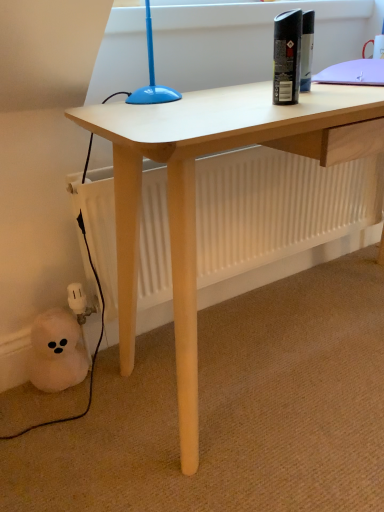
What do you see at coordinates (92, 356) in the screenshot? I see `black rubber cable at lower left` at bounding box center [92, 356].

Find the location of a particular element. black rubber cable at lower left is located at coordinates coord(92,356).

Describe the element at coordinates (287, 57) in the screenshot. This screenshot has height=512, width=384. I see `black matte spray can at upper right` at that location.

The image size is (384, 512). I want to click on black matte spray can at upper right, so click(x=287, y=57).

Find the location of `black rubber cable at lower left`. black rubber cable at lower left is located at coordinates (92, 356).

Is black rubber cable at lower left to the left of black matte spray can at upper right from the viewer's perspective?

Indeed, black rubber cable at lower left is positioned on the left side of black matte spray can at upper right.

Considering the positions of objects black rubber cable at lower left and black matte spray can at upper right in the image provided, who is in front, black rubber cable at lower left or black matte spray can at upper right?

black matte spray can at upper right.

Which is behind, point (95, 352) or point (282, 94)?

The point (95, 352) is behind.

From the image's perspective, is black rubber cable at lower left located above black matte spray can at upper right?

Actually, black rubber cable at lower left appears below black matte spray can at upper right in the image.

From a real-world perspective, does black rubber cable at lower left stand above black matte spray can at upper right?

No, from a real-world perspective, black rubber cable at lower left is not over black matte spray can at upper right

Does black rubber cable at lower left have a greater width compared to black matte spray can at upper right?

Indeed, black rubber cable at lower left has a greater width compared to black matte spray can at upper right.

Is black rubber cable at lower left taller than black matte spray can at upper right?

Correct, black rubber cable at lower left is much taller as black matte spray can at upper right.

Is black rubber cable at lower left bigger than black matte spray can at upper right?

Yes, black rubber cable at lower left is bigger than black matte spray can at upper right.

Can we say black rubber cable at lower left lies outside black matte spray can at upper right?

Yes, black rubber cable at lower left is outside of black matte spray can at upper right.

Are black rubber cable at lower left and black matte spray can at upper right far apart?

No, black rubber cable at lower left is in close proximity to black matte spray can at upper right.

Could you tell me if black rubber cable at lower left is turned towards black matte spray can at upper right?

No, black rubber cable at lower left is not facing towards black matte spray can at upper right.

What's the angular difference between black rubber cable at lower left and black matte spray can at upper right's facing directions?

The facing directions of black rubber cable at lower left and black matte spray can at upper right are 0.00332 degrees apart.

How far apart are black rubber cable at lower left and black matte spray can at upper right?

They are 25.35 inches apart.

Locate an element on the screen. The width and height of the screenshot is (384, 512). cable lying on the left of black matte spray can at upper right is located at coordinates (92, 356).

Between black matte spray can at upper right and black rubber cable at lower left, which one appears on the right side from the viewer's perspective?

black matte spray can at upper right.

Is the position of black matte spray can at upper right less distant than that of black rubber cable at lower left?

Yes, it is in front of black rubber cable at lower left.

Which is closer, [274,88] or [84,414]?

Clearly, point [274,88] is closer to the camera than point [84,414].

In the scene shown: From the image's perspective, which one is positioned lower, black matte spray can at upper right or black rubber cable at lower left?

From the image's view, black rubber cable at lower left is below.

From a real-world perspective, does black matte spray can at upper right stand above black rubber cable at lower left?

Indeed, from a real-world perspective, black matte spray can at upper right stands above black rubber cable at lower left.

Based on the photo, is black matte spray can at upper right wider or thinner than black rubber cable at lower left?

black matte spray can at upper right is thinner than black rubber cable at lower left.

Is black matte spray can at upper right taller or shorter than black rubber cable at lower left?

Clearly, black matte spray can at upper right is shorter compared to black rubber cable at lower left.

Who is bigger, black matte spray can at upper right or black rubber cable at lower left?

black rubber cable at lower left is bigger.

Choose the correct answer: Is black matte spray can at upper right inside black rubber cable at lower left or outside it?

black matte spray can at upper right is outside black rubber cable at lower left.

Would you say black matte spray can at upper right is a long distance from black rubber cable at lower left?

No, there isn't a large distance between black matte spray can at upper right and black rubber cable at lower left.

Is black matte spray can at upper right oriented away from black rubber cable at lower left?

No, black matte spray can at upper right is not facing away from black rubber cable at lower left.

The height and width of the screenshot is (512, 384). What are the coordinates of `cable that appears below the black matte spray can at upper right (from a real-world perspective)` in the screenshot? It's located at (92, 356).

Where is `cable lying below the black matte spray can at upper right (from the image's perspective)`? cable lying below the black matte spray can at upper right (from the image's perspective) is located at coordinates (92, 356).

I want to click on bottle above the black rubber cable at lower left (from a real-world perspective), so click(287, 57).